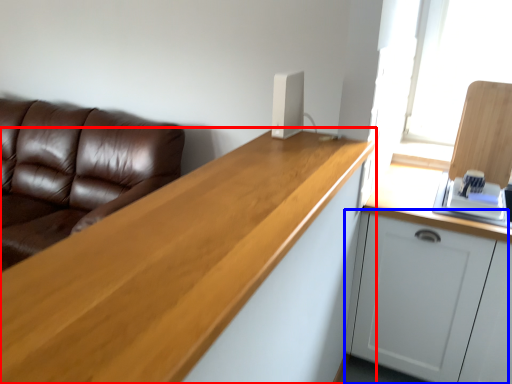
Question: Which point is further to the camera, countertop (highlighted by a red box) or cabinetry (highlighted by a blue box)?

Choices:
 (A) countertop
 (B) cabinetry

Answer: (B)